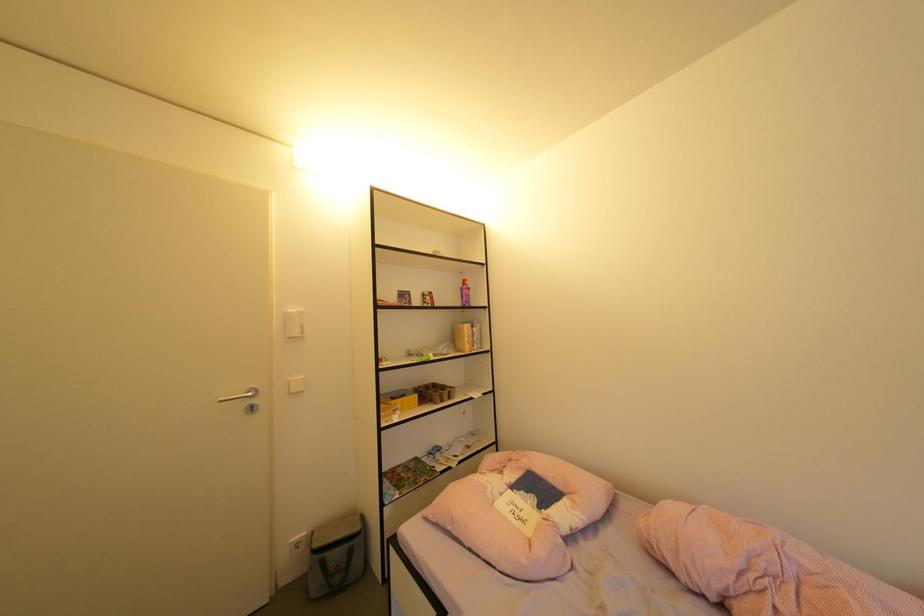
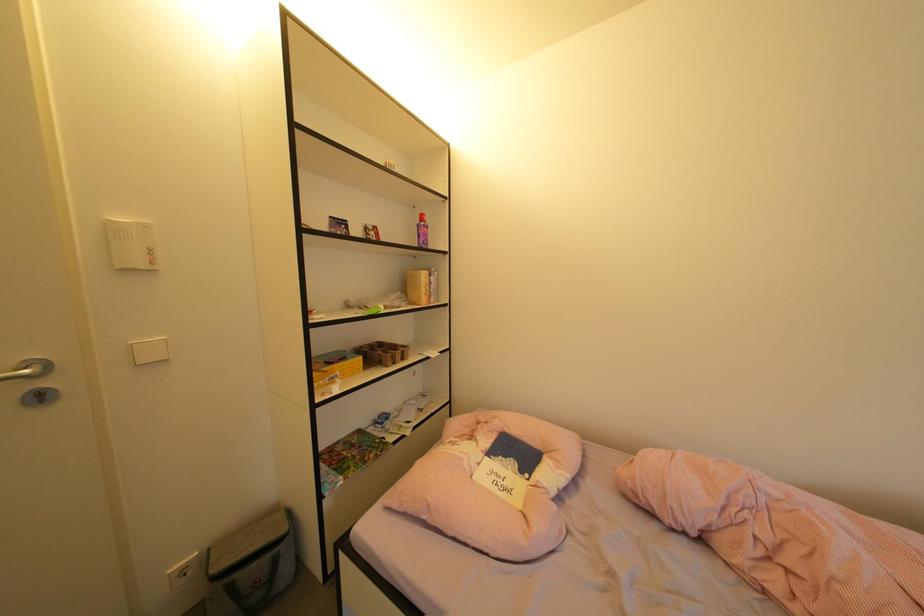
The images are taken continuously from a first-person perspective. In which direction are you moving?

The cameraman moved toward left, forward.